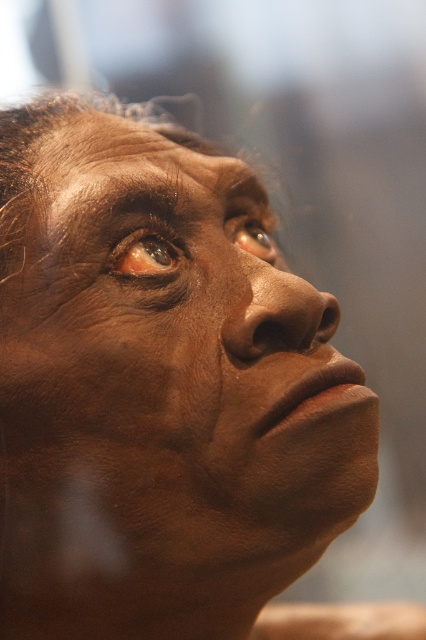
You are an artist sketching this face and want to place the brown matte eye at upper left and the brown matte eye at upper center accurately. Which eye should you draw first if you start from the left side of the face?

You should draw the brown matte eye at upper left first because it is located to the left of the brown matte eye at upper center.

You are a photographer adjusting your camera settings to capture a close portrait. The subject has a point marked at point (77, 147). If your camera lens has a focal length of 85mm and you want to ensure this point is in focus, what is the minimum distance you should set your focus ring to, given the point is 21.00 inches away from the viewer?

The point (77, 147) is 21.00 inches away from the viewer, so the focus ring should be set to at least 21.00 inches to ensure this point is in focus.

From the picture: You are an artist sketching the face shown in the image. You need to draw the point at position point [221,280] and point [250,234]. Which point should you draw first if you want to follow the order from closest to farthest?

You should draw point [221,280] first since it is closer to the viewer than point [250,234].